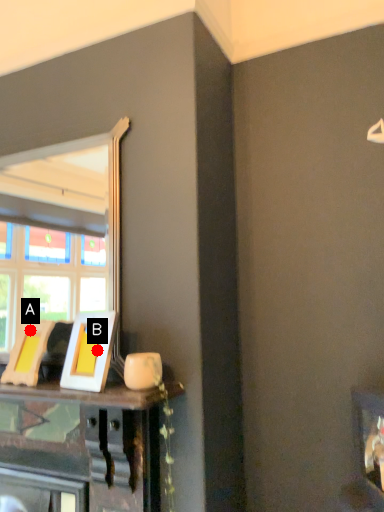
Question: Two points are circled on the image, labeled by A and B beside each circle. Which of the following is the farthest from the observer?

Choices:
 (A) A is further
 (B) B is further

Answer: (A)